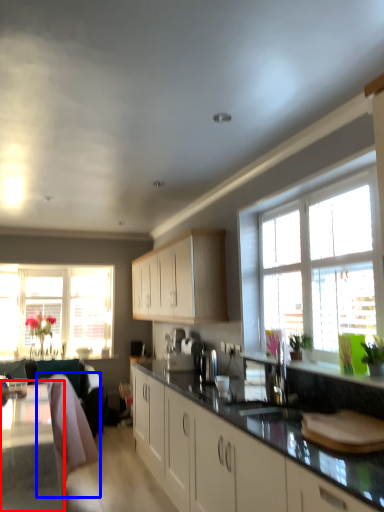
Question: Which object is further to the camera taking this photo, table (highlighted by a red box) or swivel chair (highlighted by a blue box)?

Choices:
 (A) table
 (B) swivel chair

Answer: (B)